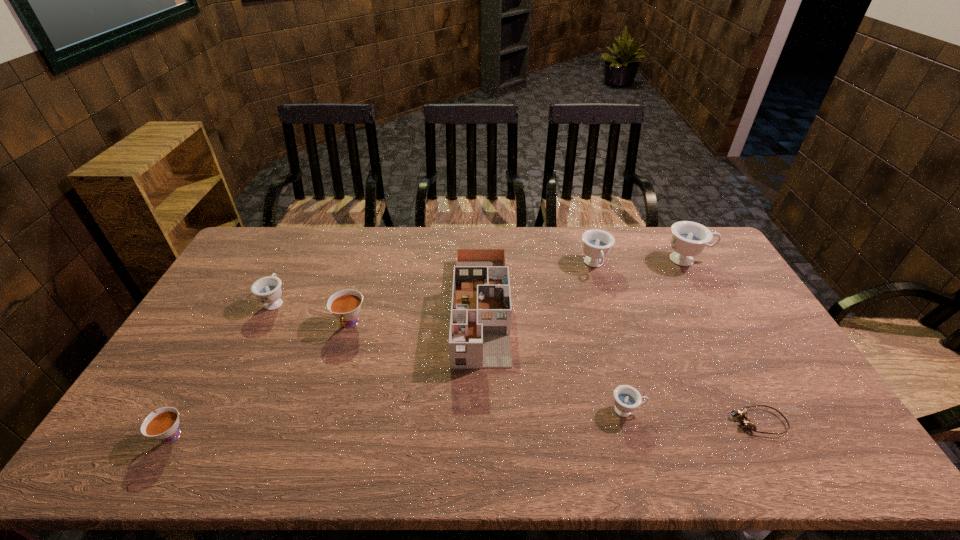
You are a GUI agent. You are given a task and a screenshot of the screen. Output one action in this format:
    pyautogui.click(x=<x>, y=<y>)
    Task: Click on the object present at the far right corner
    This screenshot has height=540, width=960.
    Given the screenshot: What is the action you would take?
    pyautogui.click(x=689, y=239)

The image size is (960, 540). Find the location of `object that is at the near right corner`. object that is at the near right corner is located at coordinates (746, 423).

Find the location of a particular element. free space at the far edge is located at coordinates click(298, 233).

Find the location of a particular element. vacant region at the near edge is located at coordinates (773, 455).

Locate an element on the screen. Image resolution: width=960 pixels, height=540 pixels. vacant region at the left edge is located at coordinates (230, 321).

This screenshot has width=960, height=540. Find the location of `vacant area at the right edge`. vacant area at the right edge is located at coordinates (713, 297).

Locate an element on the screen. This screenshot has height=540, width=960. vacant space at the near left corner is located at coordinates (106, 463).

Identify the location of vacant space at the far right corner of the desktop. (712, 259).

Where is `vacant space that is in between the fourth teacup from right to left and the left white teacup`? This screenshot has width=960, height=540. vacant space that is in between the fourth teacup from right to left and the left white teacup is located at coordinates (260, 380).

This screenshot has height=540, width=960. Identify the location of vacant area that lies between the white dollhouse and the biggest blue teacup. (585, 284).